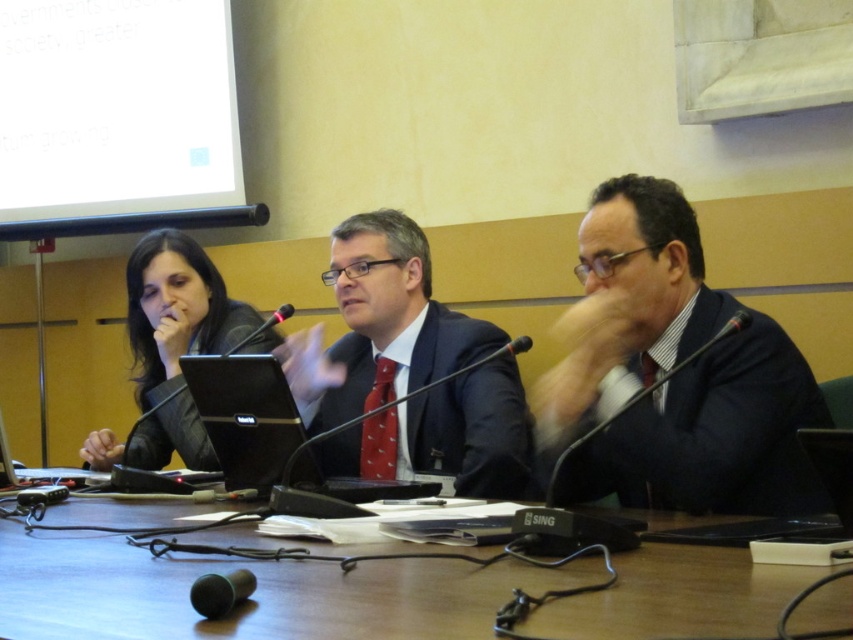
You are organizing a conference and need to ensure all equipment fits on the table. Given the wooden table at center and the silver metallic laptop at center, which item is more likely to require additional space due to its size?

The silver metallic laptop at center is taller than the wooden table at center, so it may require additional space for placement or visibility.